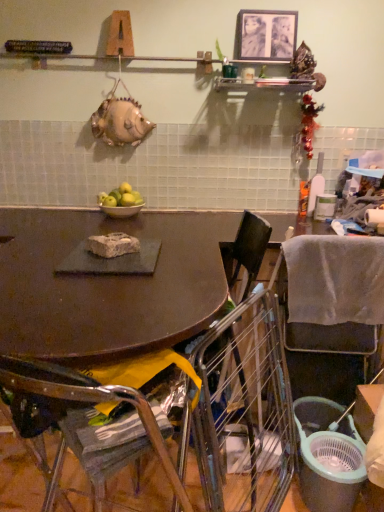
The image size is (384, 512). Find the location of `blank space above matte black table at center (from a real-world perspective)`. blank space above matte black table at center (from a real-world perspective) is located at coordinates (100, 281).